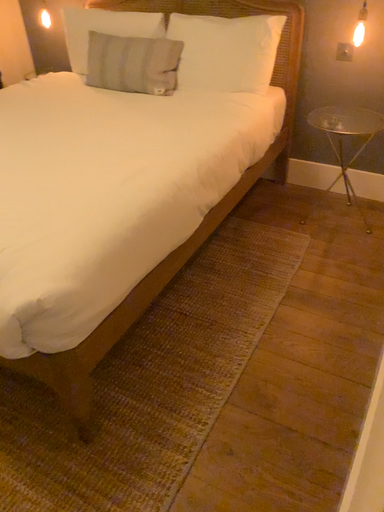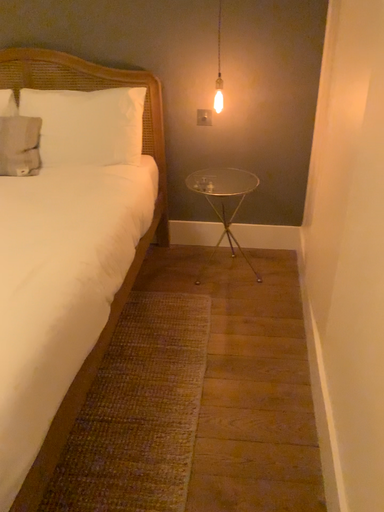
Question: Which way did the camera rotate in the video?

Choices:
 (A) rotated downward
 (B) rotated upward

Answer: (B)